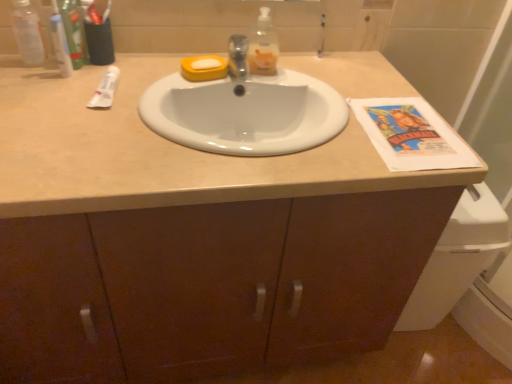
At what (x,y) coordinates should I click in order to perform the action: click on white glossy sink at center. Please return your answer as a coordinate pair (x, y). This screenshot has width=512, height=384. Looking at the image, I should click on (244, 110).

Which of these two, white glossy sink at center or translucent plastic toothbrush holder at upper left, which appears as the 1th toiletry when viewed from the right, is wider?

white glossy sink at center is wider.

Considering the relative positions of white glossy sink at center and translucent plastic toothbrush holder at upper left, positioned as the second toiletry in left-to-right order, in the image provided, is white glossy sink at center in front of translucent plastic toothbrush holder at upper left, positioned as the second toiletry in left-to-right order,?

Yes, white glossy sink at center is closer to the viewer.

Which of these two, white glossy sink at center or translucent plastic toothbrush holder at upper left, positioned as the second toiletry in left-to-right order, is bigger?

white glossy sink at center is bigger.

Would you say white glossy sink at center contains translucent plastic toothbrush holder at upper left, positioned as the second toiletry in left-to-right order?

Actually, translucent plastic toothbrush holder at upper left, positioned as the second toiletry in left-to-right order, is outside white glossy sink at center.

Considering the relative sizes of translucent plastic soap dispenser at upper center, placed as the first bottle when sorted from right to left, and white glossy sink at center in the image provided, is translucent plastic soap dispenser at upper center, placed as the first bottle when sorted from right to left, thinner than white glossy sink at center?

Yes, translucent plastic soap dispenser at upper center, placed as the first bottle when sorted from right to left, is thinner than white glossy sink at center.

Is translucent plastic soap dispenser at upper center, the second bottle in the left-to-right sequence, surrounding white glossy sink at center?

Actually, white glossy sink at center is outside translucent plastic soap dispenser at upper center, the second bottle in the left-to-right sequence.

How many degrees apart are the facing directions of translucent plastic soap dispenser at upper center, the second bottle in the left-to-right sequence, and white glossy sink at center?

0.000223 degrees.

From the image's perspective, is translucent plastic soap dispenser at upper center, placed as the first bottle when sorted from right to left, located above white glossy sink at center?

Correct, translucent plastic soap dispenser at upper center, placed as the first bottle when sorted from right to left, appears higher than white glossy sink at center in the image.

How many degrees apart are the facing directions of white matte tube at upper left and green plastic toothpaste tube at upper left, which ranks as the first toiletry in left-to-right order?

The angle between the facing direction of white matte tube at upper left and the facing direction of green plastic toothpaste tube at upper left, which ranks as the first toiletry in left-to-right order, is 0.000237 degrees.

Looking at this image, does white matte tube at upper left come behind green plastic toothpaste tube at upper left, which ranks as the first toiletry in left-to-right order?

That is False.

Does white matte tube at upper left appear on the left side of green plastic toothpaste tube at upper left, which ranks as the first toiletry in left-to-right order?

In fact, white matte tube at upper left is to the right of green plastic toothpaste tube at upper left, which ranks as the first toiletry in left-to-right order.

From the image's perspective, relative to green plastic toothpaste tube at upper left, which ranks as the first toiletry in left-to-right order, is white matte tube at upper left above or below?

From the image's perspective, white matte tube at upper left appears below green plastic toothpaste tube at upper left, which ranks as the first toiletry in left-to-right order.

Is translucent plastic soap dispenser at upper center, placed as the first bottle when sorted from right to left, not inside white matte tube at upper left?

Yes.

Between translucent plastic soap dispenser at upper center, placed as the first bottle when sorted from right to left, and white matte tube at upper left, which one appears on the right side from the viewer's perspective?

translucent plastic soap dispenser at upper center, placed as the first bottle when sorted from right to left, is more to the right.

Where is `bottle on the right of white matte tube at upper left`? bottle on the right of white matte tube at upper left is located at coordinates (263, 46).

Are white matte tube at upper left and white glossy sink at center making contact?

No, white matte tube at upper left is not making contact with white glossy sink at center.

From the picture: Is white matte tube at upper left aimed at white glossy sink at center?

No, white matte tube at upper left is not turned towards white glossy sink at center.

Would you say white matte tube at upper left is outside white glossy sink at center?

Yes, white matte tube at upper left is located beyond the bounds of white glossy sink at center.

Does point (95, 103) appear closer or farther from the camera than point (227, 96)?

Point (95, 103) is positioned closer to the camera compared to point (227, 96).

Between transparent plastic bottle at upper left, the first bottle in the left-to-right sequence, and green plastic toothpaste tube at upper left, which ranks as the first toiletry in left-to-right order, which one appears on the left side from the viewer's perspective?

From the viewer's perspective, transparent plastic bottle at upper left, the first bottle in the left-to-right sequence, appears more on the left side.

Is transparent plastic bottle at upper left, acting as the 2th bottle starting from the right, smaller than green plastic toothpaste tube at upper left, placed as the 2th toiletry when sorted from right to left?

Yes.

In the scene shown: Does transparent plastic bottle at upper left, acting as the 2th bottle starting from the right, have a greater width compared to green plastic toothpaste tube at upper left, placed as the 2th toiletry when sorted from right to left?

No.

Looking at this image, does transparent plastic bottle at upper left, acting as the 2th bottle starting from the right, come in front of green plastic toothpaste tube at upper left, which ranks as the first toiletry in left-to-right order?

No, transparent plastic bottle at upper left, acting as the 2th bottle starting from the right, is further to the viewer.

Is point (33, 57) behind point (293, 146)?

Yes, it is behind point (293, 146).

Would you consider transparent plastic bottle at upper left, the first bottle in the left-to-right sequence, to be distant from white glossy sink at center?

transparent plastic bottle at upper left, the first bottle in the left-to-right sequence, is near white glossy sink at center, not far away.

Between transparent plastic bottle at upper left, acting as the 2th bottle starting from the right, and white glossy sink at center, which one has more height?

With more height is transparent plastic bottle at upper left, acting as the 2th bottle starting from the right.

Is transparent plastic bottle at upper left, acting as the 2th bottle starting from the right, oriented away from white glossy sink at center?

transparent plastic bottle at upper left, acting as the 2th bottle starting from the right, does not have its back to white glossy sink at center.

Locate an element on the screen. The height and width of the screenshot is (384, 512). sink below the translucent plastic toothbrush holder at upper left, positioned as the second toiletry in left-to-right order (from the image's perspective) is located at coordinates (244, 110).

This screenshot has width=512, height=384. What are the coordinates of `sink located in front of the translucent plastic soap dispenser at upper center, the second bottle in the left-to-right sequence` in the screenshot? It's located at (244, 110).

When comparing their distances from white matte tube at upper left, does translucent plastic soap dispenser at upper center, placed as the first bottle when sorted from right to left, or transparent plastic bottle at upper left, the first bottle in the left-to-right sequence, seem further?

Based on the image, translucent plastic soap dispenser at upper center, placed as the first bottle when sorted from right to left, appears to be further to white matte tube at upper left.

Which object lies nearer to the anchor point white glossy sink at center, transparent plastic bottle at upper left, acting as the 2th bottle starting from the right, or green plastic toothpaste tube at upper left, which ranks as the first toiletry in left-to-right order?

Based on the image, green plastic toothpaste tube at upper left, which ranks as the first toiletry in left-to-right order, appears to be nearer to white glossy sink at center.

From the image, which object appears to be nearer to translucent plastic soap dispenser at upper center, the second bottle in the left-to-right sequence, white glossy sink at center or translucent plastic toothbrush holder at upper left, which appears as the 1th toiletry when viewed from the right?

Among the two, white glossy sink at center is located nearer to translucent plastic soap dispenser at upper center, the second bottle in the left-to-right sequence.

When comparing their distances from transparent plastic bottle at upper left, the first bottle in the left-to-right sequence, does translucent plastic toothbrush holder at upper left, which appears as the 1th toiletry when viewed from the right, or translucent plastic soap dispenser at upper center, the second bottle in the left-to-right sequence, seem closer?

translucent plastic toothbrush holder at upper left, which appears as the 1th toiletry when viewed from the right, is closer to transparent plastic bottle at upper left, the first bottle in the left-to-right sequence.

When comparing their distances from white glossy sink at center, does green plastic toothpaste tube at upper left, placed as the 2th toiletry when sorted from right to left, or translucent plastic soap dispenser at upper center, placed as the first bottle when sorted from right to left, seem closer?

The object closer to white glossy sink at center is translucent plastic soap dispenser at upper center, placed as the first bottle when sorted from right to left.

Estimate the real-world distances between objects in this image. Which object is further from transparent plastic bottle at upper left, the first bottle in the left-to-right sequence, white glossy sink at center or translucent plastic soap dispenser at upper center, the second bottle in the left-to-right sequence?

The object further to transparent plastic bottle at upper left, the first bottle in the left-to-right sequence, is translucent plastic soap dispenser at upper center, the second bottle in the left-to-right sequence.

When comparing their distances from transparent plastic bottle at upper left, acting as the 2th bottle starting from the right, does green plastic toothpaste tube at upper left, which ranks as the first toiletry in left-to-right order, or translucent plastic toothbrush holder at upper left, which appears as the 1th toiletry when viewed from the right, seem further?

translucent plastic toothbrush holder at upper left, which appears as the 1th toiletry when viewed from the right, is further to transparent plastic bottle at upper left, acting as the 2th bottle starting from the right.

Considering their positions, is white matte tube at upper left positioned further to green plastic toothpaste tube at upper left, placed as the 2th toiletry when sorted from right to left, than white glossy sink at center?

white glossy sink at center.

Image resolution: width=512 pixels, height=384 pixels. I want to click on toothpaste between transparent plastic bottle at upper left, the first bottle in the left-to-right sequence, and translucent plastic soap dispenser at upper center, the second bottle in the left-to-right sequence, so click(x=105, y=89).

Where is `toothpaste located between translucent plastic toothbrush holder at upper left, positioned as the second toiletry in left-to-right order, and white glossy sink at center in the left-right direction`? The width and height of the screenshot is (512, 384). toothpaste located between translucent plastic toothbrush holder at upper left, positioned as the second toiletry in left-to-right order, and white glossy sink at center in the left-right direction is located at coordinates (105, 89).

The height and width of the screenshot is (384, 512). Find the location of `toiletry situated between transparent plastic bottle at upper left, acting as the 2th bottle starting from the right, and translucent plastic toothbrush holder at upper left, which appears as the 1th toiletry when viewed from the right, from left to right`. toiletry situated between transparent plastic bottle at upper left, acting as the 2th bottle starting from the right, and translucent plastic toothbrush holder at upper left, which appears as the 1th toiletry when viewed from the right, from left to right is located at coordinates (73, 32).

Identify the location of sink between white matte tube at upper left and translucent plastic soap dispenser at upper center, placed as the first bottle when sorted from right to left. This screenshot has height=384, width=512. (244, 110).